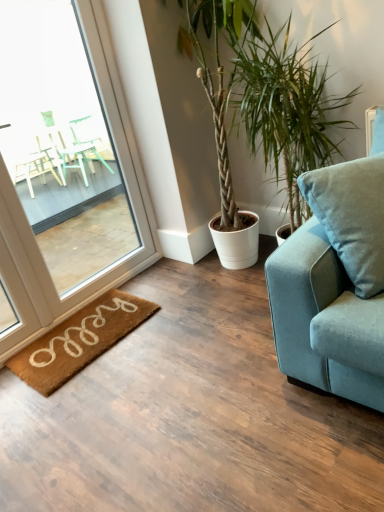
Question: Can we say green leafy plant at center lies outside clear glass window at left?

Choices:
 (A) yes
 (B) no

Answer: (A)

Question: Is green leafy plant at center turned away from clear glass window at left?

Choices:
 (A) no
 (B) yes

Answer: (A)

Question: From the image's perspective, is green leafy plant at center above clear glass window at left?

Choices:
 (A) yes
 (B) no

Answer: (A)

Question: Is the depth of green leafy plant at center less than that of clear glass window at left?

Choices:
 (A) no
 (B) yes

Answer: (A)

Question: Can you confirm if green leafy plant at center is bigger than clear glass window at left?

Choices:
 (A) yes
 (B) no

Answer: (A)

Question: Is green leafy plant at center thinner than clear glass window at left?

Choices:
 (A) yes
 (B) no

Answer: (B)

Question: Does clear glass window at left have a lesser height compared to green leafy plant at center?

Choices:
 (A) yes
 (B) no

Answer: (B)

Question: Is clear glass window at left closer to camera compared to green leafy plant at center?

Choices:
 (A) yes
 (B) no

Answer: (A)

Question: From the image's perspective, is clear glass window at left under green leafy plant at center?

Choices:
 (A) yes
 (B) no

Answer: (A)

Question: Is clear glass window at left oriented away from green leafy plant at center?

Choices:
 (A) no
 (B) yes

Answer: (A)

Question: Is clear glass window at left completely or partially outside of green leafy plant at center?

Choices:
 (A) no
 (B) yes

Answer: (B)

Question: Does clear glass window at left have a lesser width compared to green leafy plant at center?

Choices:
 (A) yes
 (B) no

Answer: (A)

Question: Can you confirm if velvet blue couch at right is taller than brown coir mat at lower left?

Choices:
 (A) no
 (B) yes

Answer: (B)